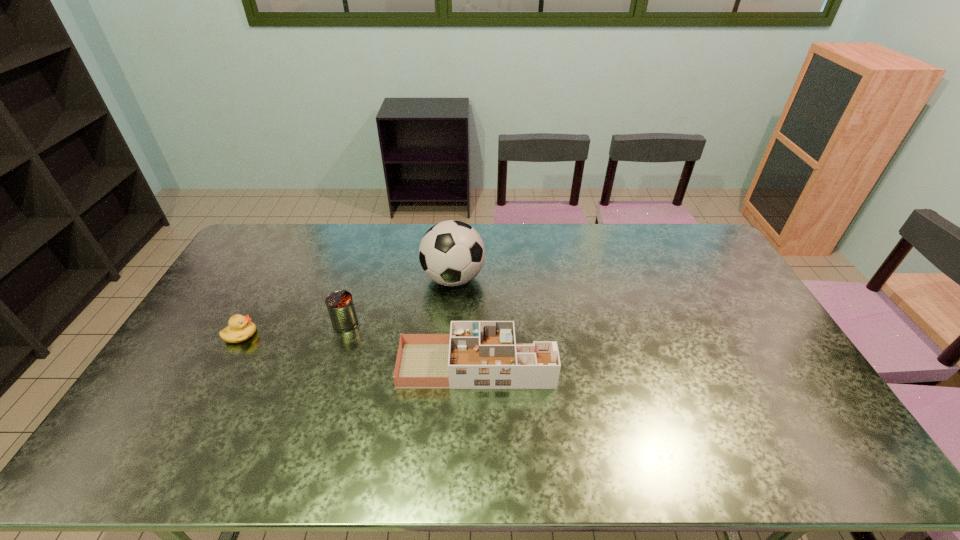
Where is `the farthest object`? The height and width of the screenshot is (540, 960). the farthest object is located at coordinates (451, 253).

Identify the location of soccer ball. (451, 253).

Locate an element on the screen. the third shortest object is located at coordinates (340, 305).

Image resolution: width=960 pixels, height=540 pixels. Find the location of `the third object from right to left`. the third object from right to left is located at coordinates (340, 305).

Identify the location of dollhouse. (476, 354).

Find the location of a particular element. The height and width of the screenshot is (540, 960). the shortest object is located at coordinates (240, 329).

At what (x,y) coordinates should I click in order to perform the action: click on the leftmost object. Please return your answer as a coordinate pair (x, y). The image size is (960, 540). Looking at the image, I should click on pos(240,329).

You are a GUI agent. You are given a task and a screenshot of the screen. Output one action in this format:
    pyautogui.click(x=<x>, y=<y>)
    Task: Click on the vacant space located 0.170m on the right of the farthest object
    The image size is (960, 540).
    Given the screenshot: What is the action you would take?
    pyautogui.click(x=533, y=279)

Find the location of a particular element. vacant space located on the front of the second tallest object is located at coordinates (331, 369).

Where is `free space located at the front door of the dollhouse`? free space located at the front door of the dollhouse is located at coordinates (570, 365).